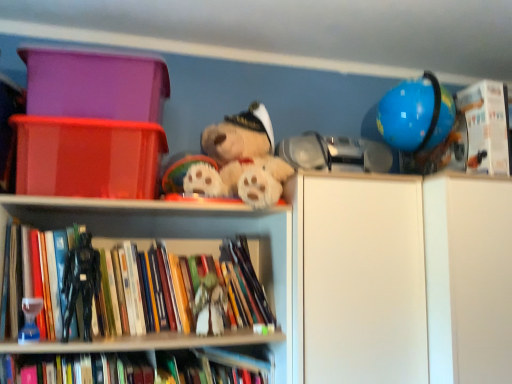
Question: Is white matte cabinet at right not inside matte plastic storage box at upper left, which ranks as the first storage box in top-to-bottom order?

Choices:
 (A) no
 (B) yes

Answer: (B)

Question: Is white matte cabinet at right thinner than matte plastic storage box at upper left, which ranks as the first storage box in top-to-bottom order?

Choices:
 (A) yes
 (B) no

Answer: (B)

Question: Is white matte cabinet at right next to matte plastic storage box at upper left, which ranks as the first storage box in top-to-bottom order?

Choices:
 (A) yes
 (B) no

Answer: (B)

Question: Does white matte cabinet at right contain matte plastic storage box at upper left, which is the second storage box from bottom to top?

Choices:
 (A) no
 (B) yes

Answer: (A)

Question: Is the position of white matte cabinet at right less distant than that of matte plastic storage box at upper left, which is the second storage box from bottom to top?

Choices:
 (A) no
 (B) yes

Answer: (B)

Question: Is white matte cabinet at right to the left or to the right of matte plastic storage box at upper left, which ranks as the first storage box in top-to-bottom order, in the image?

Choices:
 (A) right
 (B) left

Answer: (A)

Question: Does point (486, 253) appear closer or farther from the camera than point (40, 104)?

Choices:
 (A) closer
 (B) farther

Answer: (B)

Question: Considering the positions of white matte cabinet at right and matte plastic storage box at upper left, which is the second storage box from bottom to top, in the image, is white matte cabinet at right bigger or smaller than matte plastic storage box at upper left, which is the second storage box from bottom to top,?

Choices:
 (A) small
 (B) big

Answer: (B)

Question: From a real-world perspective, is white matte cabinet at right above or below matte plastic storage box at upper left, which ranks as the first storage box in top-to-bottom order?

Choices:
 (A) above
 (B) below

Answer: (B)

Question: Relative to white matte cabinet at right, is white matte figurine at center, acting as the first toy starting from the right, in front or behind?

Choices:
 (A) behind
 (B) front

Answer: (A)

Question: In terms of height, does white matte figurine at center, acting as the first toy starting from the right, look taller or shorter compared to white matte cabinet at right?

Choices:
 (A) tall
 (B) short

Answer: (B)

Question: Do you think white matte figurine at center, acting as the first toy starting from the right, is within white matte cabinet at right, or outside of it?

Choices:
 (A) inside
 (B) outside

Answer: (B)

Question: In terms of width, does white matte figurine at center, acting as the 2th toy starting from the left, look wider or thinner when compared to white matte cabinet at right?

Choices:
 (A) wide
 (B) thin

Answer: (B)

Question: From the image's perspective, is hardcover books at left, marked as the 2th book in a top-to-bottom arrangement, located above or below matte plastic storage box at upper left, which ranks as the first storage box in top-to-bottom order?

Choices:
 (A) below
 (B) above

Answer: (A)

Question: Is hardcover books at left, marked as the 2th book in a top-to-bottom arrangement, wider or thinner than matte plastic storage box at upper left, which ranks as the first storage box in top-to-bottom order?

Choices:
 (A) thin
 (B) wide

Answer: (A)